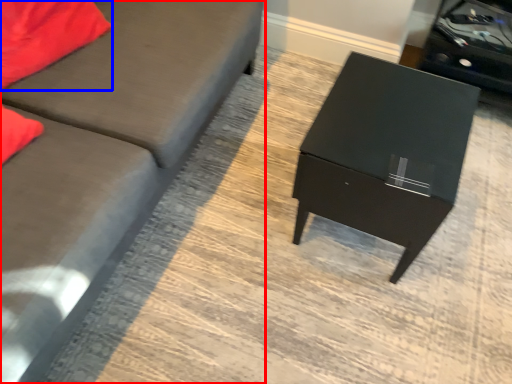
Question: Which object is closer to the camera taking this photo, studio couch (highlighted by a red box) or pillow (highlighted by a blue box)?

Choices:
 (A) studio couch
 (B) pillow

Answer: (A)